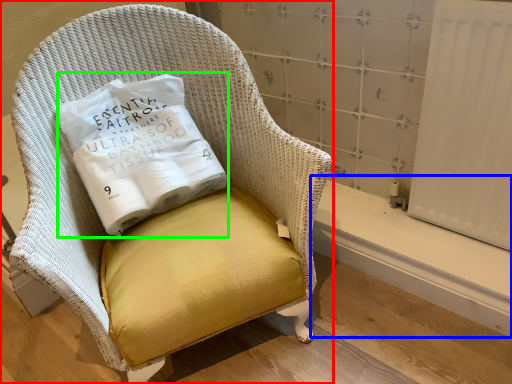
Question: Which object is positioned farthest from chair (highlighted by a red box)? Select from window sill (highlighted by a blue box) and pillow (highlighted by a green box).

Choices:
 (A) window sill
 (B) pillow

Answer: (A)